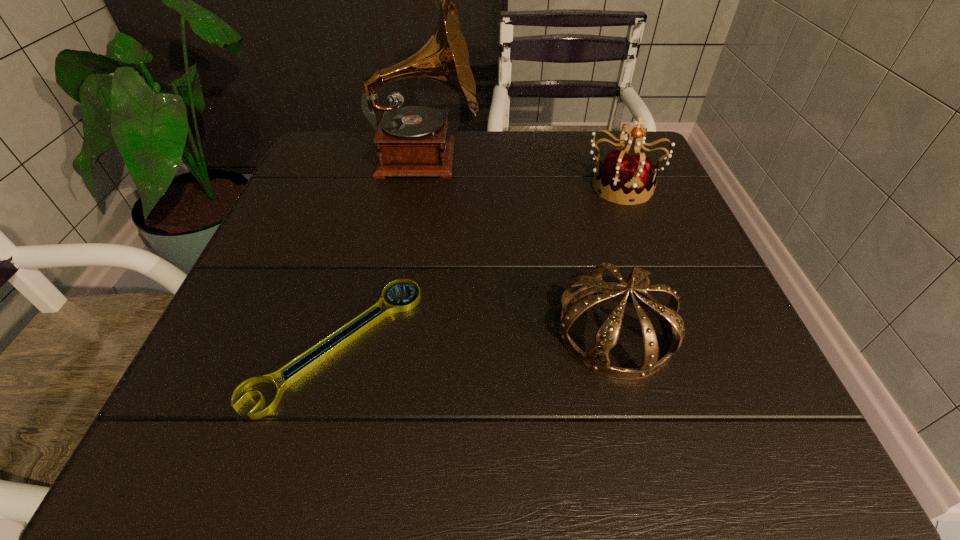
Where is `blank space at the left edge`? This screenshot has width=960, height=540. blank space at the left edge is located at coordinates (257, 293).

In the image, there is a desktop. Find the location of `vacant region at the right edge`. vacant region at the right edge is located at coordinates (635, 231).

Identify the location of free space at the far left corner. This screenshot has width=960, height=540. (370, 146).

Locate an element on the screen. free region at the near right corner of the desktop is located at coordinates (687, 406).

I want to click on empty location between the shortest object and the shorter tiara, so click(x=476, y=337).

The width and height of the screenshot is (960, 540). I want to click on unoccupied position between the phonograph_record and the farther tiara, so click(x=523, y=172).

Identify the location of free space that is in between the second tallest object and the third tallest object. (618, 258).

You are a GUI agent. You are given a task and a screenshot of the screen. Output one action in this format:
    pyautogui.click(x=<x>, y=<y>)
    Task: Click on the free spot between the phonograph_record and the wrench
    This screenshot has width=960, height=540.
    Given the screenshot: What is the action you would take?
    pyautogui.click(x=381, y=251)

I want to click on free space between the second shortest object and the phonograph_record, so click(x=520, y=245).

Locate an element on the screen. free space between the nearer tiara and the third shortest object is located at coordinates (618, 258).